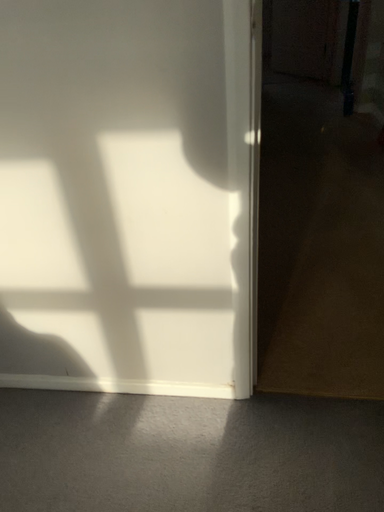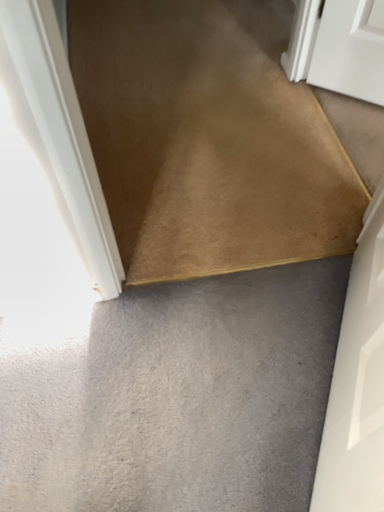
Question: Which way did the camera rotate in the video?

Choices:
 (A) rotated downward
 (B) rotated upward

Answer: (A)